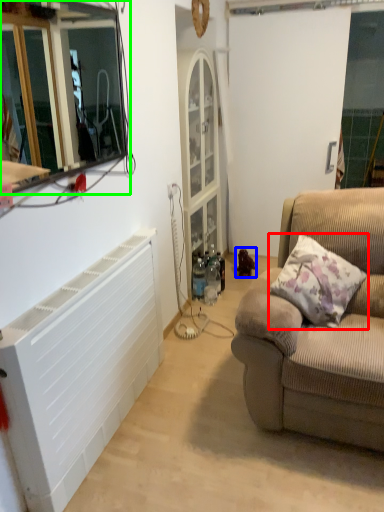
Question: Based on their relative distances, which object is farther from pillow (highlighted by a red box)? Choose from toy (highlighted by a blue box) and window frame (highlighted by a green box).

Choices:
 (A) toy
 (B) window frame

Answer: (B)